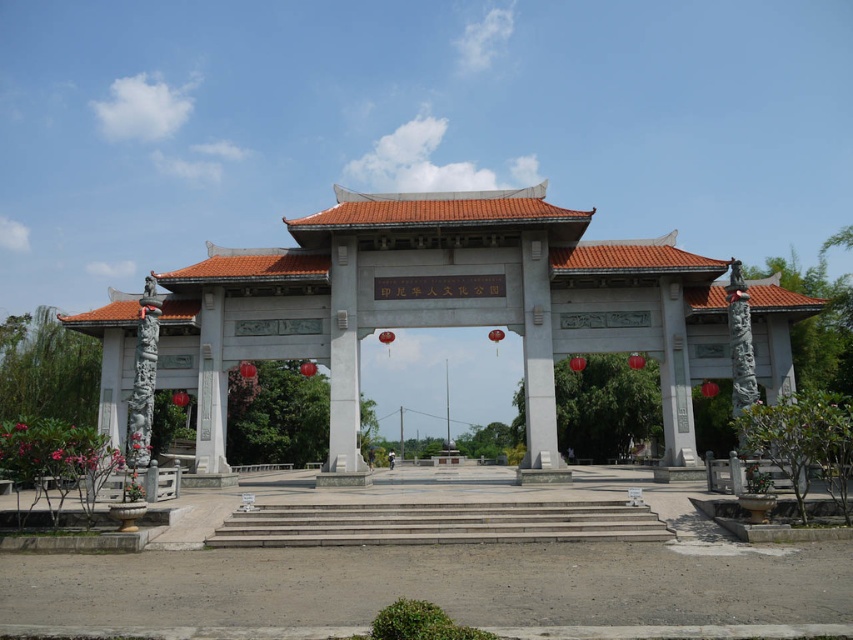
Can you confirm if white stone gate at center is smaller than concrete stairs at center?

Actually, white stone gate at center might be larger than concrete stairs at center.

Can you confirm if white stone gate at center is taller than concrete stairs at center?

Indeed, white stone gate at center has a greater height compared to concrete stairs at center.

Is point (354, 468) closer to viewer compared to point (601, 502)?

No, it is not.

Locate an element on the screen. Image resolution: width=853 pixels, height=640 pixels. white stone gate at center is located at coordinates (444, 308).